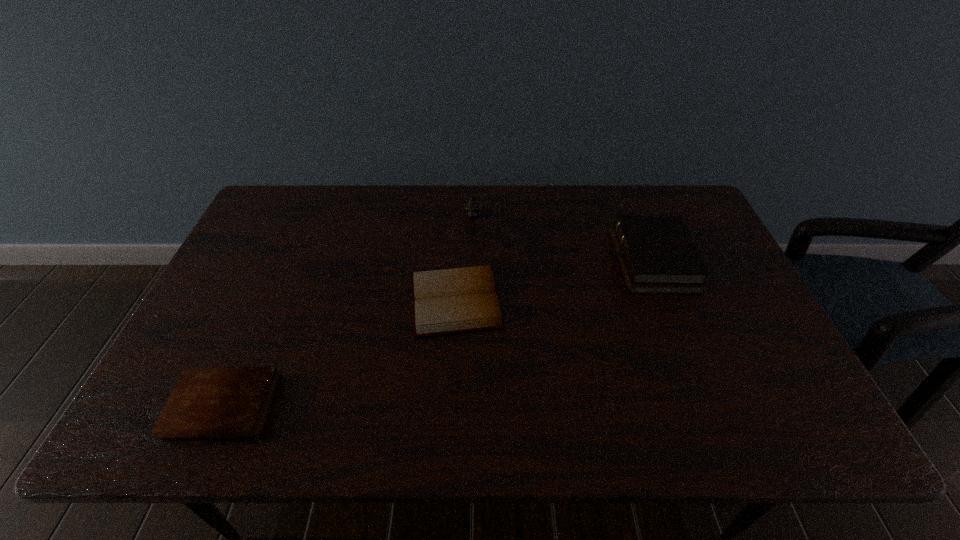
At what (x,y) coordinates should I click in order to perform the action: click on free region at the right edge. Please return your answer as a coordinate pair (x, y). The image size is (960, 540). Looking at the image, I should click on [738, 323].

I want to click on vacant area at the far left corner of the desktop, so click(276, 191).

Identify the location of free area in between the farthest object and the nearest Bible. Image resolution: width=960 pixels, height=540 pixels. (348, 311).

You are a GUI agent. You are given a task and a screenshot of the screen. Output one action in this format:
    pyautogui.click(x=<x>, y=<y>)
    Task: Click on the free space that is in between the second Bible from right to left and the farthest object
    This screenshot has height=540, width=960.
    Given the screenshot: What is the action you would take?
    pyautogui.click(x=465, y=258)

Find the location of `unoccupied area between the rightmost object and the snail`. unoccupied area between the rightmost object and the snail is located at coordinates (563, 239).

You are a GUI agent. You are given a task and a screenshot of the screen. Output one action in this format:
    pyautogui.click(x=<x>, y=<y>)
    Task: Click on the empty location between the rightmost object and the tallest object
    
    Given the screenshot: What is the action you would take?
    pyautogui.click(x=563, y=239)

I want to click on vacant space that is in between the nearest object and the tallest object, so click(x=348, y=311).

This screenshot has height=540, width=960. What are the coordinates of `free space between the snail and the rightmost Bible` in the screenshot? It's located at (563, 239).

Locate an element on the screen. Image resolution: width=960 pixels, height=540 pixels. empty location between the second Bible from left to right and the tallest Bible is located at coordinates (554, 281).

You are a GUI agent. You are given a task and a screenshot of the screen. Output one action in this format:
    pyautogui.click(x=<x>, y=<y>)
    Task: Click on the free area in between the second Bible from left to right and the snail
    The image size is (960, 540).
    Given the screenshot: What is the action you would take?
    pyautogui.click(x=465, y=258)